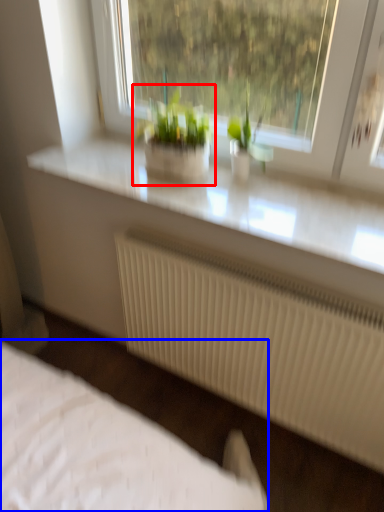
Question: Which of the following is the closest to the observer, houseplant (highlighted by a red box) or bed (highlighted by a blue box)?

Choices:
 (A) houseplant
 (B) bed

Answer: (A)